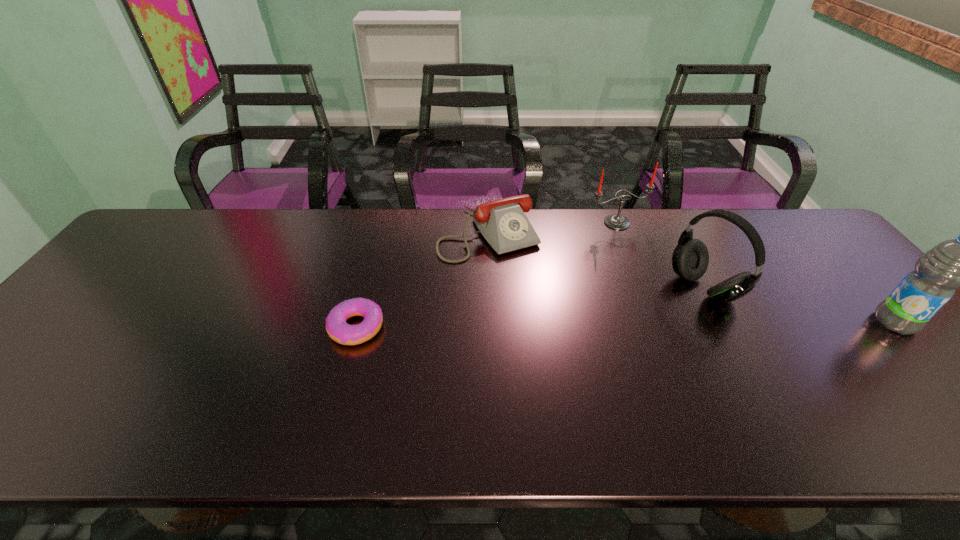
Find the location of a particular element. This screenshot has width=960, height=540. vacant point located on the ear cups of the headset is located at coordinates 641,324.

Where is `free space located on the ear cups of the headset`? Image resolution: width=960 pixels, height=540 pixels. free space located on the ear cups of the headset is located at coordinates (587, 354).

Identify the location of vacant position located 0.270m on the dial of the second object from left to right. (555, 327).

At what (x,y) coordinates should I click in order to perform the action: click on vacant space located on the dial of the second object from left to right. Please return your answer as a coordinate pair (x, y). The width and height of the screenshot is (960, 540). Looking at the image, I should click on (521, 279).

The height and width of the screenshot is (540, 960). I want to click on vacant region located on the dial of the second object from left to right, so click(x=538, y=303).

Where is `vacant position located on the front-facing side of the candle`? Image resolution: width=960 pixels, height=540 pixels. vacant position located on the front-facing side of the candle is located at coordinates (648, 254).

At what (x,y) coordinates should I click in order to perform the action: click on vacant area situated 0.360m on the front-facing side of the candle. Please return your answer as a coordinate pair (x, y). Looking at the image, I should click on (696, 311).

This screenshot has width=960, height=540. I want to click on vacant space located 0.120m on the front-facing side of the candle, so click(x=648, y=254).

This screenshot has height=540, width=960. Identify the location of telephone that is at the far edge. (503, 223).

Where is `candle that is at the far edge`? This screenshot has width=960, height=540. candle that is at the far edge is located at coordinates (614, 221).